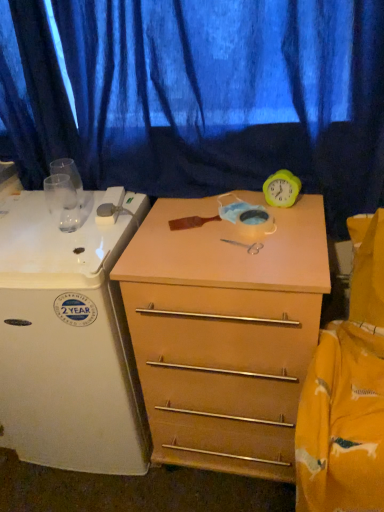
Locate an element on the screen. The height and width of the screenshot is (512, 384). vacant space positioned to the left of yellow rubber clock at upper right is located at coordinates (209, 212).